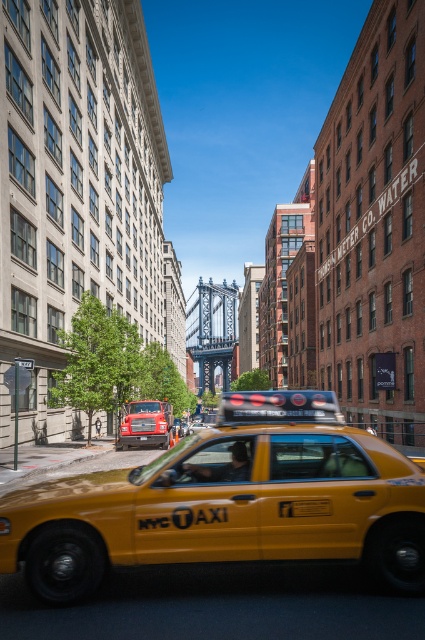
You are a delivery driver in a van that is 7 meters long. You need to pass through the gap between the yellow matte taxi at center and the yellow rubber nyc taxi at center. Can your van fit through the gap between them?

The gap between the yellow matte taxi at center and the yellow rubber nyc taxi at center is 19.67 meters. Since your van is only 7 meters long, it can easily fit through the gap between them.

You are a city planner analyzing traffic flow. You need to determine if the yellow rubber nyc taxi at center can fit under a low bridge that the yellow matte taxi cab at center can pass through. Based on their heights, what is your conclusion?

The yellow rubber nyc taxi at center is shorter than the yellow matte taxi cab at center. Since the yellow matte taxi cab at center can pass under the bridge, the yellow rubber nyc taxi at center, being shorter, should also be able to pass under the same bridge without any issues.